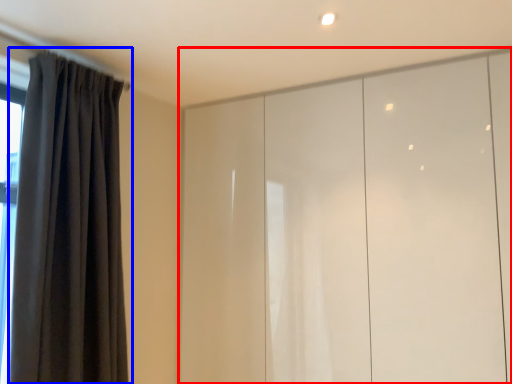
Question: Which object is further to the camera taking this photo, cupboard (highlighted by a red box) or curtain (highlighted by a blue box)?

Choices:
 (A) cupboard
 (B) curtain

Answer: (A)